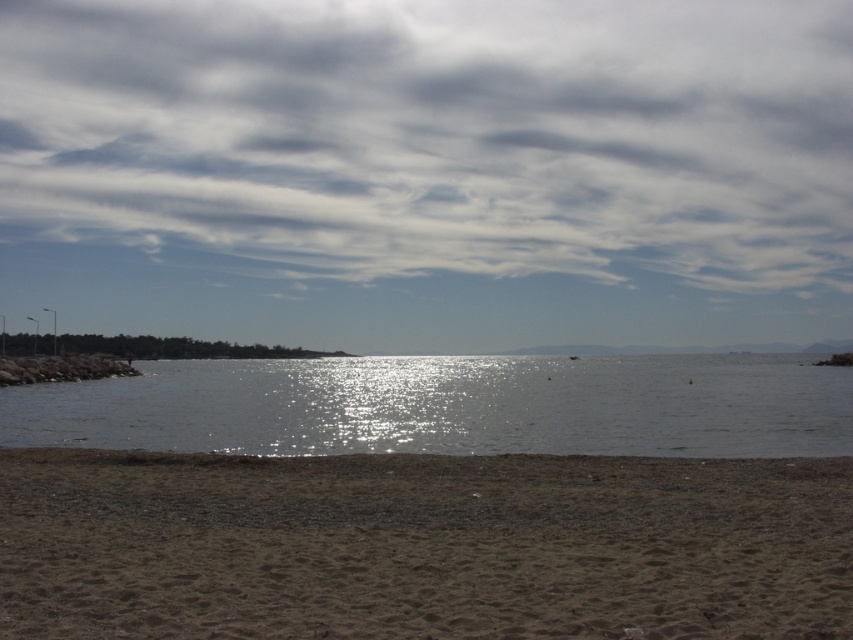
Question: Which of these objects is positioned farthest from the glistening water at center?

Choices:
 (A) brown sandy beach at lower center
 (B) cloudy sky at upper center

Answer: (B)

Question: Is cloudy sky at upper center closer to the viewer compared to brown sandy beach at lower center?

Choices:
 (A) yes
 (B) no

Answer: (B)

Question: Is brown sandy beach at lower center above glistening water at center?

Choices:
 (A) yes
 (B) no

Answer: (A)

Question: Can you confirm if cloudy sky at upper center is wider than brown sandy beach at lower center?

Choices:
 (A) no
 (B) yes

Answer: (B)

Question: Which object is positioned closest to the brown sandy beach at lower center?

Choices:
 (A) cloudy sky at upper center
 (B) glistening water at center

Answer: (B)

Question: Which of these objects is positioned farthest from the brown sandy beach at lower center?

Choices:
 (A) glistening water at center
 (B) cloudy sky at upper center

Answer: (B)